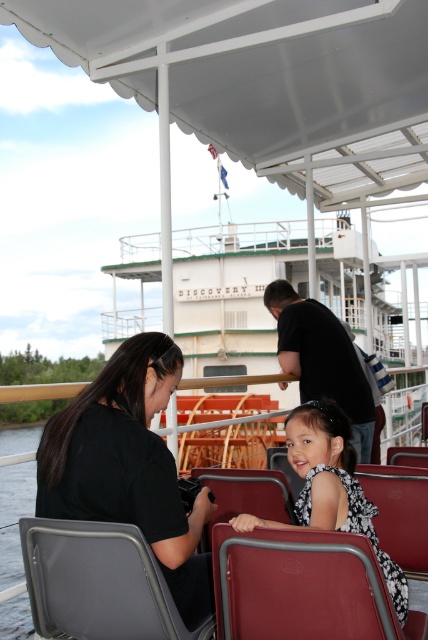
Who is more distant from viewer, (237, 541) or (365, 512)?

Point (365, 512)

From the picture: Does leather-like red chair at lower center have a greater width compared to white printed dress at center?

Incorrect, leather-like red chair at lower center's width does not surpass white printed dress at center's.

In order to click on leather-like red chair at lower center in this screenshot , I will do `click(302, 588)`.

Can you confirm if black matte shirt at left is wider than gray fabric chair at lower left?

Indeed, black matte shirt at left has a greater width compared to gray fabric chair at lower left.

How much distance is there between black matte shirt at left and gray fabric chair at lower left?

The distance of black matte shirt at left from gray fabric chair at lower left is 24.14 centimeters.

Where is `black matte shirt at left`? The image size is (428, 640). black matte shirt at left is located at coordinates (128, 467).

Where is `black matte shirt at left`? The width and height of the screenshot is (428, 640). black matte shirt at left is located at coordinates (128, 467).

Is the position of black matte shirt at left more distant than that of leather-like red chair at lower center?

That is True.

This screenshot has width=428, height=640. Identify the location of black matte shirt at left. (128, 467).

Locate an element on the screen. black matte shirt at left is located at coordinates (128, 467).